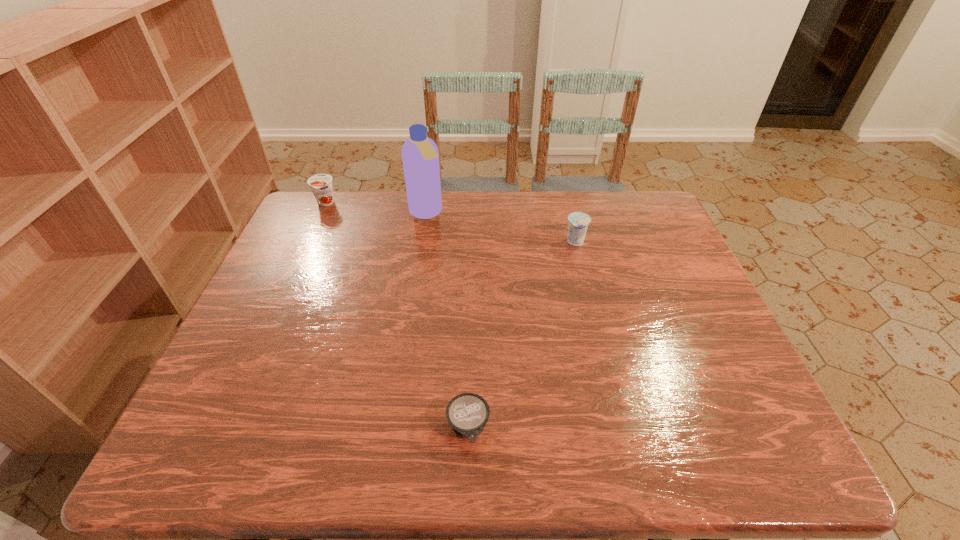
The image size is (960, 540). I want to click on the second object from left to right, so click(x=420, y=156).

In order to click on shampoo in this screenshot , I will do `click(420, 156)`.

Image resolution: width=960 pixels, height=540 pixels. What are the coordinates of `the leftmost yogurt` in the screenshot? It's located at (321, 184).

Identify the location of the leftmost object. (321, 184).

Identify the location of the second nearest yogurt. (578, 222).

At what (x,y) coordinates should I click in order to perform the action: click on the rightmost yogurt. Please return your answer as a coordinate pair (x, y). Looking at the image, I should click on (578, 222).

What are the coordinates of `the nearest yogurt` in the screenshot? It's located at (467, 413).

Where is `the nearest object`? The width and height of the screenshot is (960, 540). the nearest object is located at coordinates [467, 413].

Image resolution: width=960 pixels, height=540 pixels. I want to click on free space located on the right of the tallest object, so point(570,213).

What are the coordinates of `vacant space located on the front of the leftmost object` in the screenshot? It's located at (311, 234).